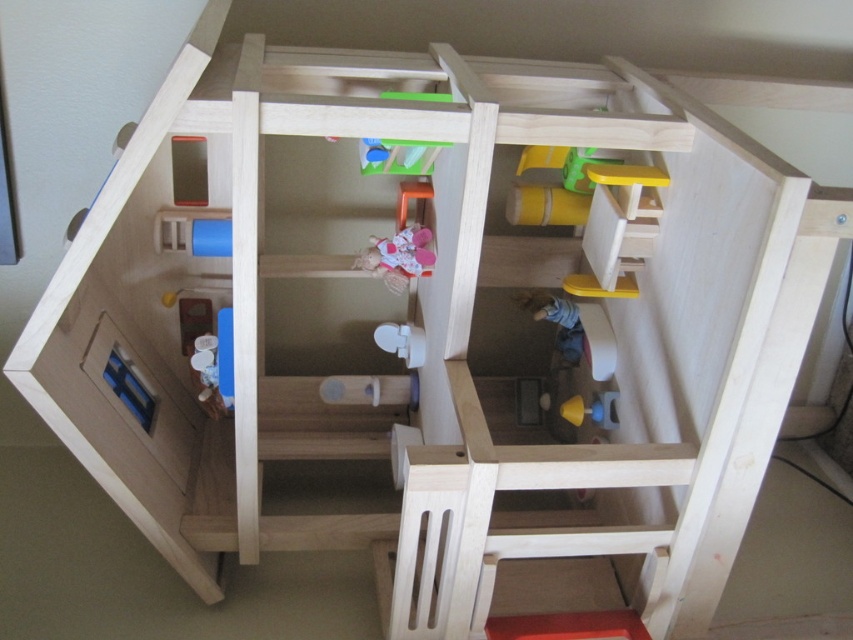
You are a child playing with the dollhouse and want to pick up the blue fabric doll at center and the smooth yellow cup at center. Which object should you reach for first if you want to grab the one that is higher up?

The blue fabric doll at center is located above the smooth yellow cup at center, so you should reach for the blue fabric doll at center first.

You are a child trying to fit both the matte pink doll at center and the blue fabric doll at center into a small toy box. Which doll should you place first to ensure both fit inside?

The matte pink doll at center occupies less space than the blue fabric doll at center, so you should place the blue fabric doll at center first to make room for the smaller one.

You are a toy delivery person who needs to place a new toy that is 40 inches long into the dollhouse. The smooth red stool at lower center is in the way. Is the toy too long to fit past the stool?

The distance of smooth red stool at lower center from camera is 38.99 inches. The toy is 40 inches long, which is longer than the available space, so it cannot fit past the stool.